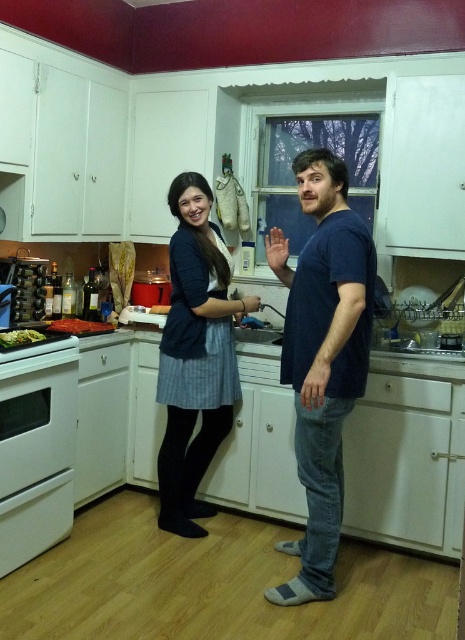
Between dark blue t-shirt at center and denim skirt at center, which one appears on the left side from the viewer's perspective?

denim skirt at center is more to the left.

Between point (326, 433) and point (187, 465), which one is positioned in front?

Positioned in front is point (326, 433).

Is point (337, 216) more distant than point (218, 436)?

No.

Identify the location of dark blue t-shirt at center. The image size is (465, 640). (x=323, y=356).

Which is above, dark blue t-shirt at center or green leafy vegetables at stove front?

green leafy vegetables at stove front is above.

Does dark blue t-shirt at center appear on the right side of green leafy vegetables at stove front?

Yes, dark blue t-shirt at center is to the right of green leafy vegetables at stove front.

Describe the element at coordinates (323, 356) in the screenshot. I see `dark blue t-shirt at center` at that location.

Identify the location of dark blue t-shirt at center. (323, 356).

Which is more to the left, red matte pizza at lower left or green leafy vegetables at stove front?

From the viewer's perspective, green leafy vegetables at stove front appears more on the left side.

Is red matte pizza at lower left smaller than green leafy vegetables at stove front?

Actually, red matte pizza at lower left might be larger than green leafy vegetables at stove front.

Who is more forward, (62, 326) or (39, 336)?

Point (39, 336)

I want to click on red matte pizza at lower left, so click(x=79, y=326).